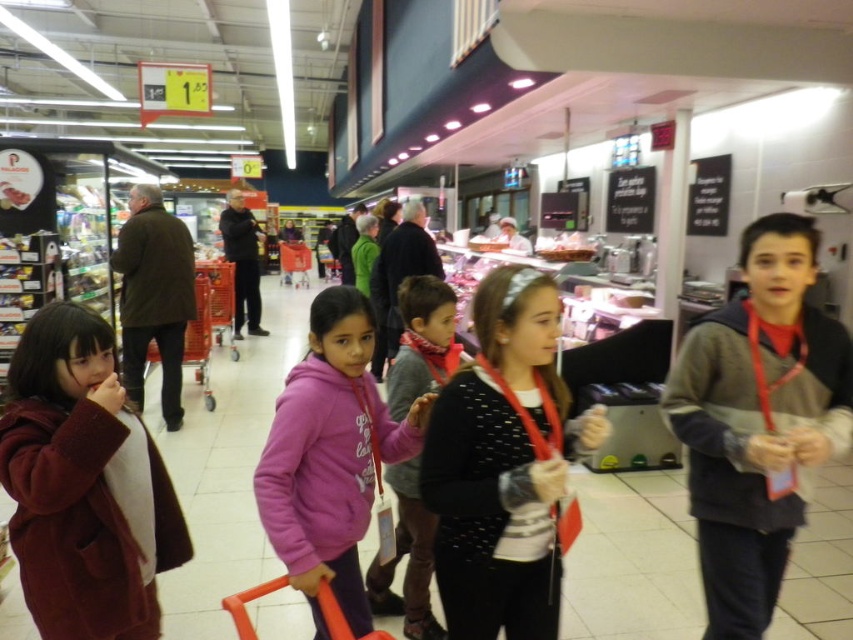
Question: Which is nearer to the pink fleece jacket at center?

Choices:
 (A) pink fleece hoodie at center
 (B) maroon woolen coat at lower left

Answer: (A)

Question: Which point is closer to the camera?

Choices:
 (A) pink fleece hoodie at center
 (B) maroon woolen coat at lower left
 (C) matte black sweater at center
 (D) pink fleece jacket at center

Answer: (C)

Question: Considering the relative positions of maroon woolen coat at lower left and matte black sweater at center in the image provided, where is maroon woolen coat at lower left located with respect to matte black sweater at center?

Choices:
 (A) left
 (B) right

Answer: (A)

Question: Is matte black sweater at center to the right of pink fleece jacket at center from the viewer's perspective?

Choices:
 (A) yes
 (B) no

Answer: (A)

Question: Which point is farther to the camera?

Choices:
 (A) (355, 394)
 (B) (433, 620)
 (C) (113, 579)
 (D) (448, 422)

Answer: (B)

Question: Can you confirm if pink fleece hoodie at center is wider than pink fleece jacket at center?

Choices:
 (A) yes
 (B) no

Answer: (A)